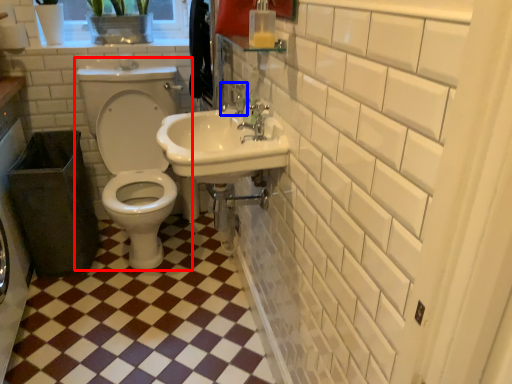
Question: Which object is closer to the camera taking this photo, toilet (highlighted by a red box) or plumbing fixture (highlighted by a blue box)?

Choices:
 (A) toilet
 (B) plumbing fixture

Answer: (B)